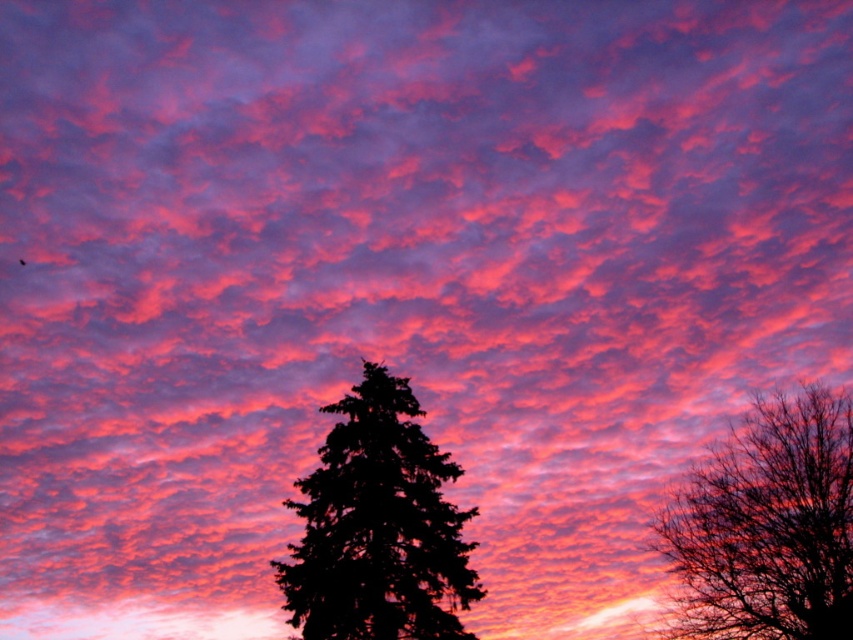
Is silhouette bare tree at center below black textured tree at center?

No, silhouette bare tree at center is not below black textured tree at center.

Who is positioned more to the left, silhouette bare tree at center or black textured tree at center?

From the viewer's perspective, black textured tree at center appears more on the left side.

Is point (833, 518) less distant than point (346, 628)?

That is False.

What are the coordinates of `silhouette bare tree at center` in the screenshot? It's located at (767, 525).